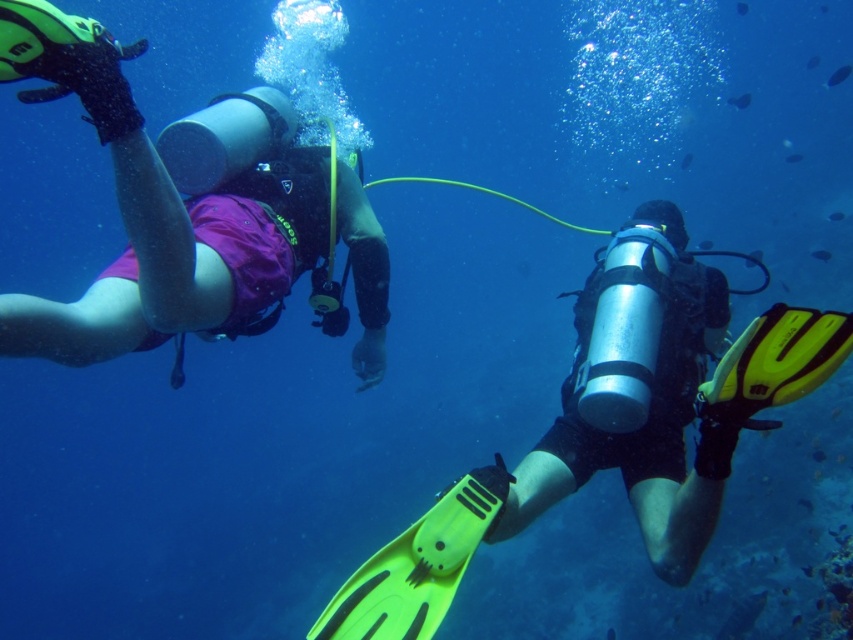
Question: Which point appears closest to the camera in this image?

Choices:
 (A) coord(686,339)
 (B) coord(19,333)

Answer: (B)

Question: Which object appears closest to the camera in this image?

Choices:
 (A) matte silver cylinder at center
 (B) matte purple shorts at left

Answer: (B)

Question: Which of the following is the farthest from the observer?

Choices:
 (A) (218, 244)
 (B) (691, 305)

Answer: (B)

Question: In this image, where is matte purple shorts at left located relative to matte silver cylinder at center?

Choices:
 (A) right
 (B) left

Answer: (B)

Question: In this image, where is matte purple shorts at left located relative to matte silver cylinder at center?

Choices:
 (A) below
 (B) above

Answer: (B)

Question: Is the position of matte purple shorts at left more distant than that of matte silver cylinder at center?

Choices:
 (A) yes
 (B) no

Answer: (B)